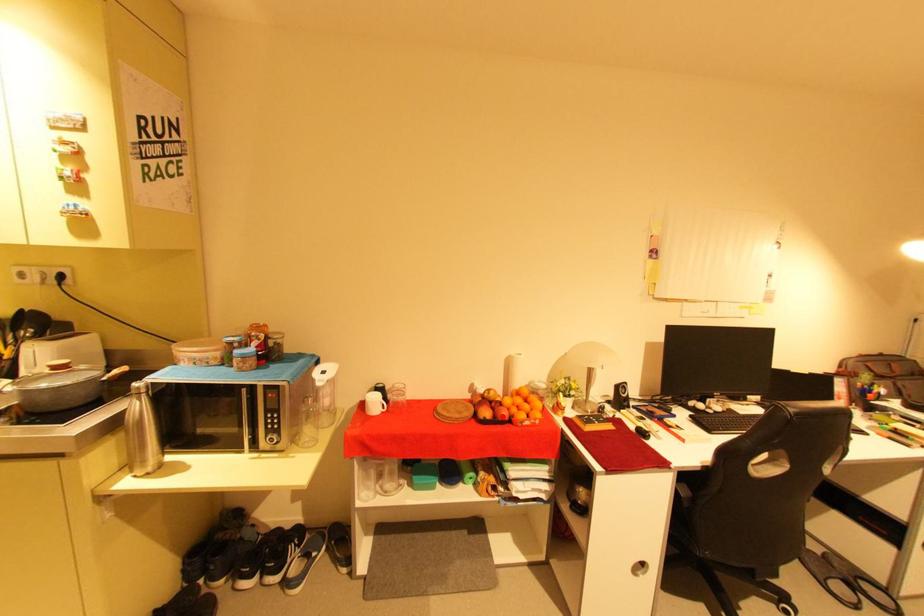
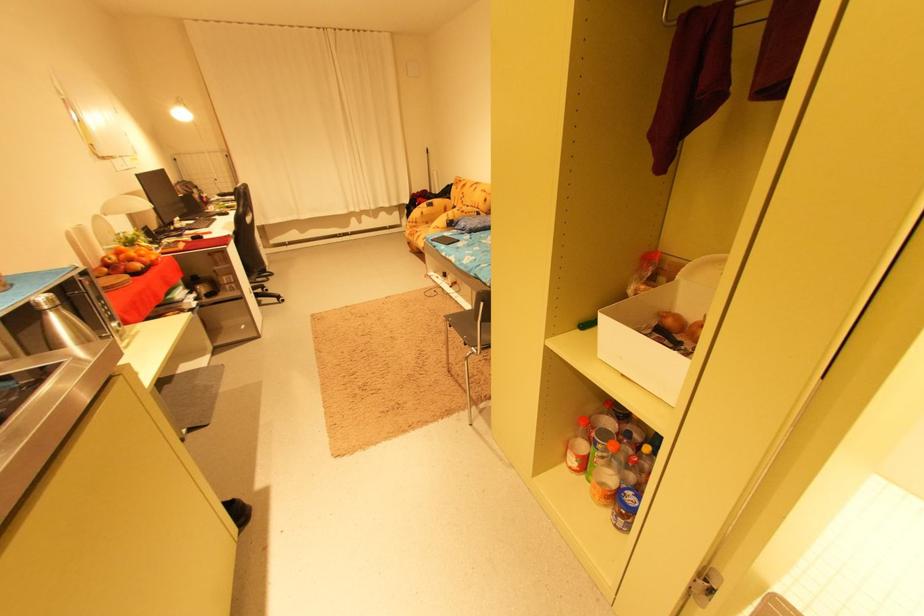
Question: I am providing you with two images of the same scene from different viewpoints. A red point is marked on the first image. Is the red point's position out of view in image 2?

Choices:
 (A) Yes
 (B) No

Answer: (B)